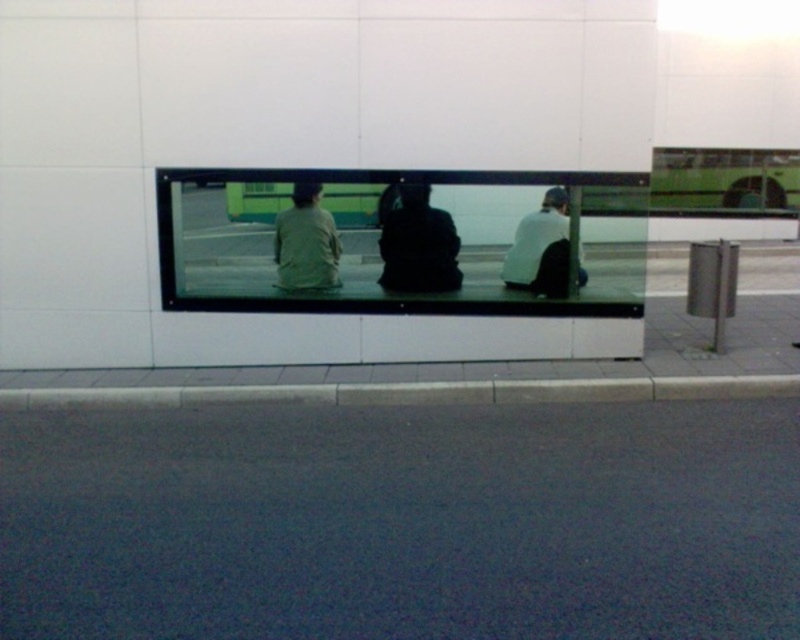
Question: Which object appears farthest from the camera in this image?

Choices:
 (A) dark matte jacket at center
 (B) light gray fabric jacket at center

Answer: (B)

Question: Based on their relative distances, which object is farther from the light gray fabric jacket at center?

Choices:
 (A) white matte jacket at center
 (B) dark matte jacket at center

Answer: (A)

Question: Is light gray fabric jacket at center in front of white matte jacket at center?

Choices:
 (A) no
 (B) yes

Answer: (A)

Question: Which is farther from the light gray fabric jacket at center?

Choices:
 (A) dark matte jacket at center
 (B) white matte jacket at center

Answer: (B)

Question: Does dark matte jacket at center have a smaller size compared to white matte jacket at center?

Choices:
 (A) no
 (B) yes

Answer: (B)

Question: Can you confirm if dark matte jacket at center is positioned to the left of white matte jacket at center?

Choices:
 (A) yes
 (B) no

Answer: (A)